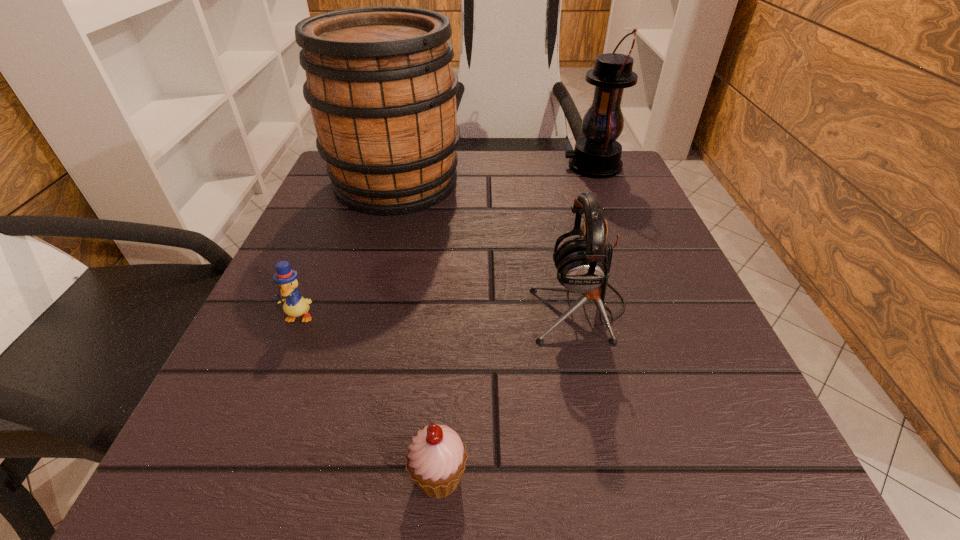
Identify the location of free spot between the duckling and the lantern. This screenshot has height=540, width=960. (445, 241).

I want to click on free spot between the third shortest object and the nearest object, so click(509, 392).

Image resolution: width=960 pixels, height=540 pixels. What are the coordinates of `free space between the nearest object and the third tallest object` in the screenshot? It's located at (509, 392).

Locate an element on the screen. Image resolution: width=960 pixels, height=540 pixels. free spot between the cider and the earphone is located at coordinates (488, 245).

Identify the location of vacant area that lies between the nearest object and the cider. (418, 329).

Locate an element on the screen. Image resolution: width=960 pixels, height=540 pixels. vacant region between the third tallest object and the duckling is located at coordinates (439, 312).

Where is `free space between the nearest object and the duckling`? The width and height of the screenshot is (960, 540). free space between the nearest object and the duckling is located at coordinates (369, 396).

The image size is (960, 540). Find the location of `object that can be found as the third closest to the lantern`. object that can be found as the third closest to the lantern is located at coordinates (294, 305).

At what (x,y) coordinates should I click in order to perform the action: click on object that stands as the closest to the lantern. Please return your answer as a coordinate pair (x, y). The height and width of the screenshot is (540, 960). Looking at the image, I should click on (379, 81).

The height and width of the screenshot is (540, 960). What are the coordinates of `vacant region that satisfies the following two spatial constraints: 1. above the lantern, indicating its light source; 2. on the front side of the cider` in the screenshot? It's located at coord(599,183).